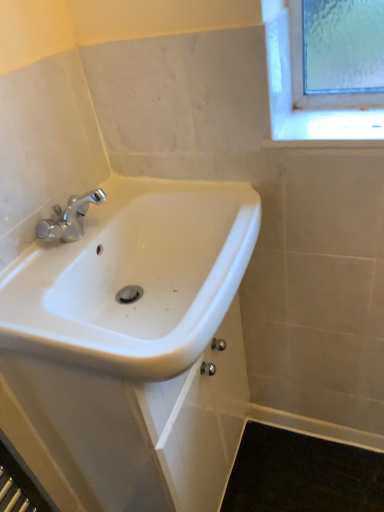
Describe the element at coordinates (134, 277) in the screenshot. I see `white glossy sink at center` at that location.

Measure the distance between white glossy sink at center and camera.

white glossy sink at center and camera are 60.55 centimeters apart.

Where is `white glossy sink at center`? This screenshot has height=512, width=384. white glossy sink at center is located at coordinates (134, 277).

Where is `white glossy sink at center`? white glossy sink at center is located at coordinates (134, 277).